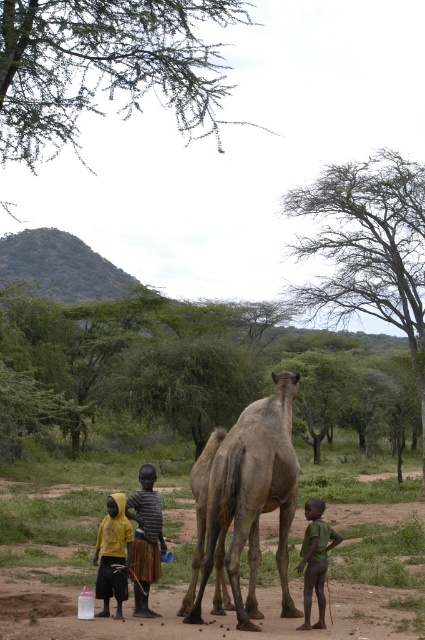
Based on the photo, does brown textured camel at center have a greater width compared to yellow matte shirt at lower left?

In fact, brown textured camel at center might be narrower than yellow matte shirt at lower left.

Does brown textured camel at center have a smaller size compared to yellow matte shirt at lower left?

Indeed, brown textured camel at center has a smaller size compared to yellow matte shirt at lower left.

The width and height of the screenshot is (425, 640). In order to click on brown textured camel at center in this screenshot , I will do `click(251, 499)`.

Who is positioned more to the right, brown dirt field at lower center or yellow matte shirt at lower left?

From the viewer's perspective, yellow matte shirt at lower left appears more on the right side.

Can you confirm if brown dirt field at lower center is positioned above yellow matte shirt at lower left?

No.

What do you see at coordinates (178, 604) in the screenshot?
I see `brown dirt field at lower center` at bounding box center [178, 604].

Locate an element on the screen. brown dirt field at lower center is located at coordinates (178, 604).

Is brown dirt field at lower center shorter than striped fabric shirt at center?

In fact, brown dirt field at lower center may be taller than striped fabric shirt at center.

Who is higher up, brown dirt field at lower center or striped fabric shirt at center?

Positioned higher is striped fabric shirt at center.

Where is `brown dirt field at lower center`? This screenshot has width=425, height=640. brown dirt field at lower center is located at coordinates (178, 604).